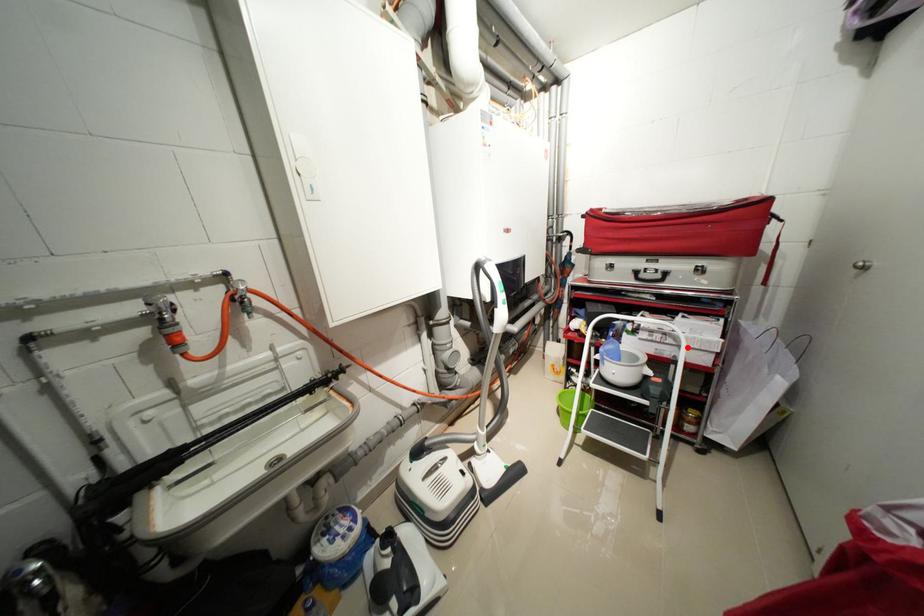
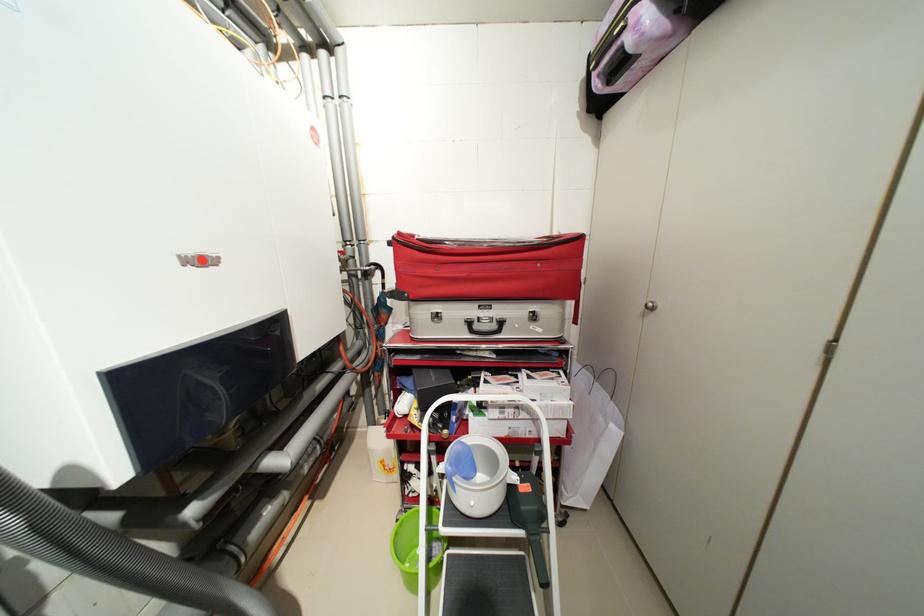
Where in the second image is the point corresponding to the highlighted location from the first image?

(541, 421)